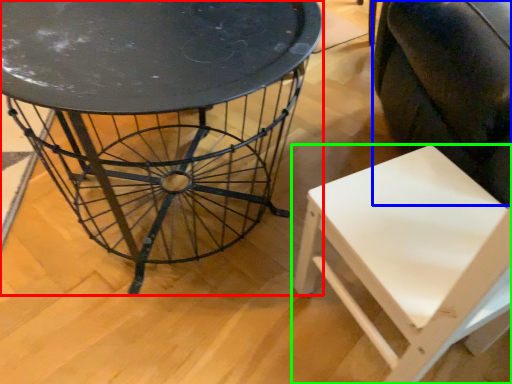
Question: Estimate the real-world distances between objects in this image. Which object is closer to table (highlighted by a red box), swivel chair (highlighted by a blue box) or chair (highlighted by a green box)?

Choices:
 (A) swivel chair
 (B) chair

Answer: (B)